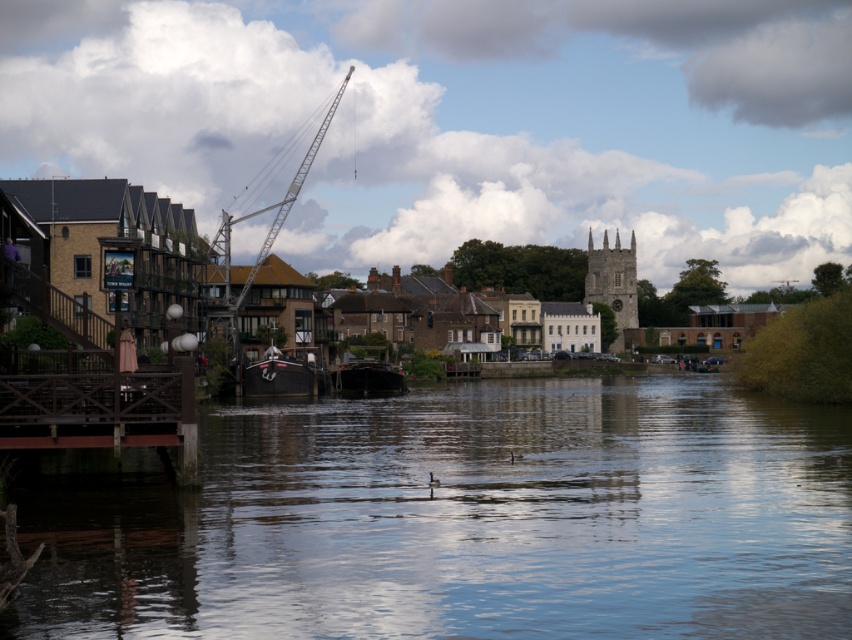
Question: Among these points, which one is farthest from the camera?

Choices:
 (A) (204, 278)
 (B) (275, 572)
 (C) (353, 369)
 (D) (279, 368)

Answer: (A)

Question: Which of the following is the farthest from the observer?

Choices:
 (A) (260, 387)
 (B) (350, 390)
 (C) (767, 548)
 (D) (280, 200)

Answer: (D)

Question: Can you confirm if metallic gray boat at center is wider than dark brown wooden boat at center?

Choices:
 (A) no
 (B) yes

Answer: (A)

Question: Which object is farther from the camera taking this photo?

Choices:
 (A) dark brown wooden boat at center
 (B) metallic gray crane at upper left
 (C) metallic gray boat at center

Answer: (A)

Question: Does metallic gray boat at center appear under dark brown wooden boat at center?

Choices:
 (A) no
 (B) yes

Answer: (A)

Question: Does metallic gray boat at center have a lesser width compared to dark brown wooden boat at center?

Choices:
 (A) yes
 (B) no

Answer: (A)